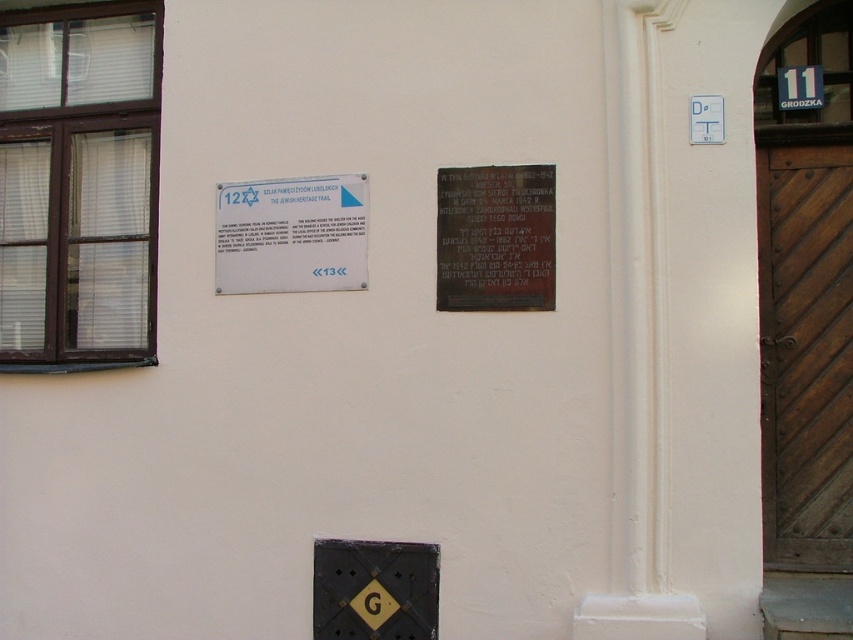
Can you confirm if white paper sign at upper left is thinner than black polished stone plaque at center?

In fact, white paper sign at upper left might be wider than black polished stone plaque at center.

Is white paper sign at upper left positioned before black polished stone plaque at center?

That is False.

Is point (318, 284) positioned before point (456, 211)?

No.

In order to click on white paper sign at upper left in this screenshot , I will do `click(291, 234)`.

Which is below, dark brown wooden door at right or white paper sign at upper left?

dark brown wooden door at right is below.

Is dark brown wooden door at right thinner than white paper sign at upper left?

Yes.

Who is more distant from viewer, (795, 364) or (347, 257)?

The point (795, 364) is behind.

The image size is (853, 640). In order to click on dark brown wooden door at right in this screenshot , I will do `click(805, 355)`.

Does dark brown wooden door at right have a larger size compared to black polished stone plaque at center?

Yes.

Between dark brown wooden door at right and black polished stone plaque at center, which one is positioned lower?

dark brown wooden door at right is lower down.

Which is behind, point (780, 483) or point (509, 220)?

The point (780, 483) is behind.

Where is `dark brown wooden door at right`? Image resolution: width=853 pixels, height=640 pixels. dark brown wooden door at right is located at coordinates (805, 355).